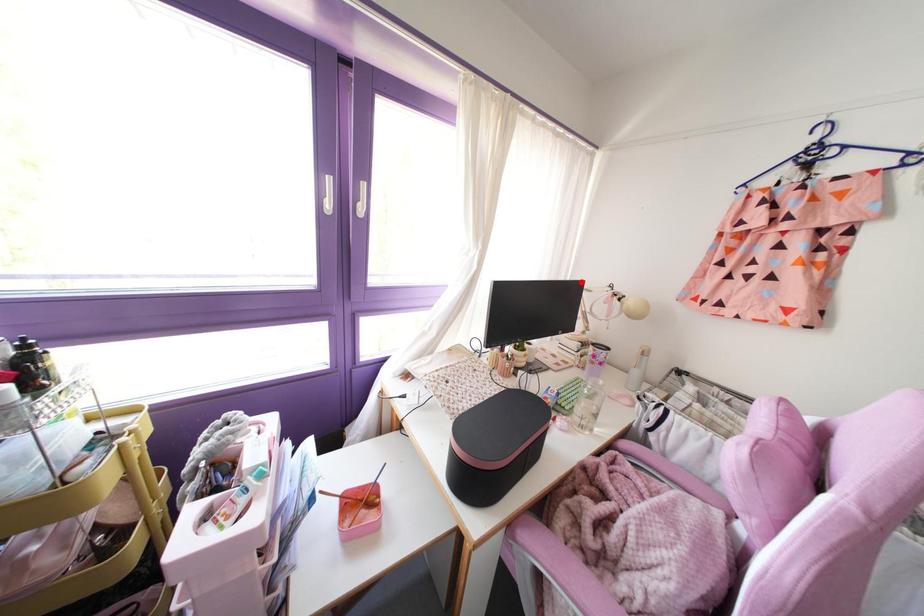
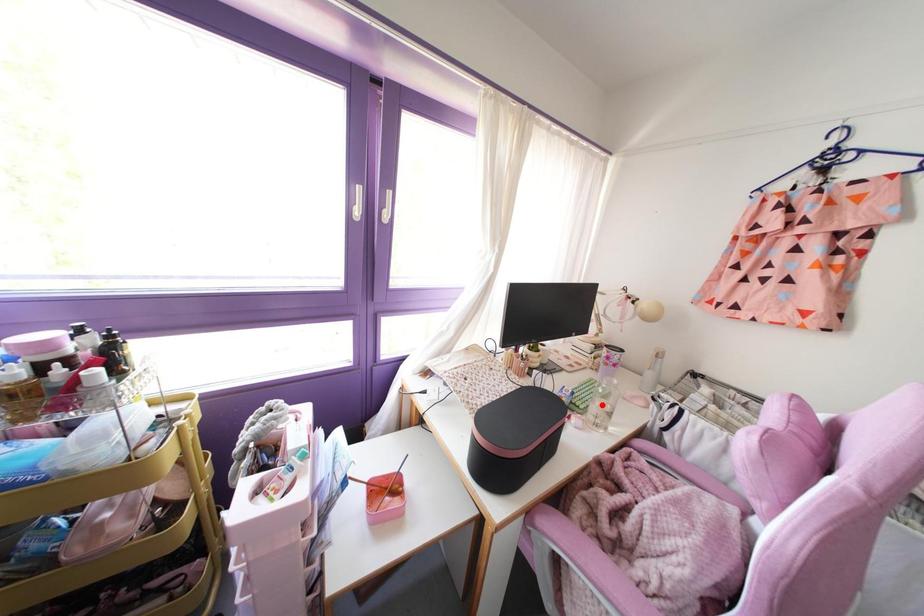
I am providing you with two images of the same scene from different viewpoints. A red point is marked on the first image and another point is marked on the second image. Is the marked point in image1 the same physical position as the marked point in image2?

No